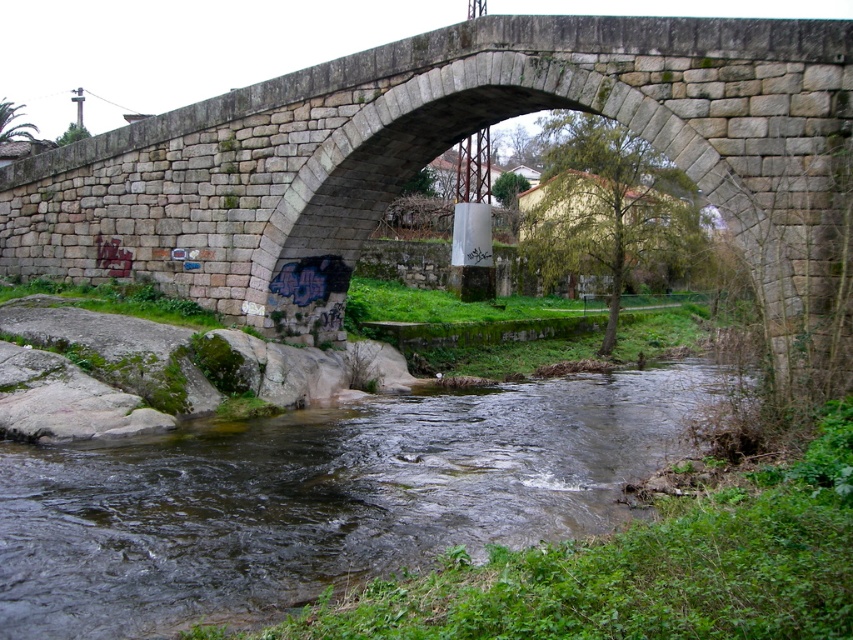
You are standing on the gray stone bridge at center and want to cross to the other side. You notice a point marked at coordinates (451, 144). What does this point represent?

The point at coordinates (451, 144) corresponds to the gray stone bridge at center, so it represents the bridge itself where you are currently standing.

You are standing on the riverbank and want to cross the river using the gray stone bridge at center. However, you notice the clear water at center below the bridge. Which object is closer to you as you stand on the bank?

The gray stone bridge at center is closer to you than the clear water at center because the bridge is positioned further to the viewer, meaning it is nearer in your line of sight compared to the water beneath it.